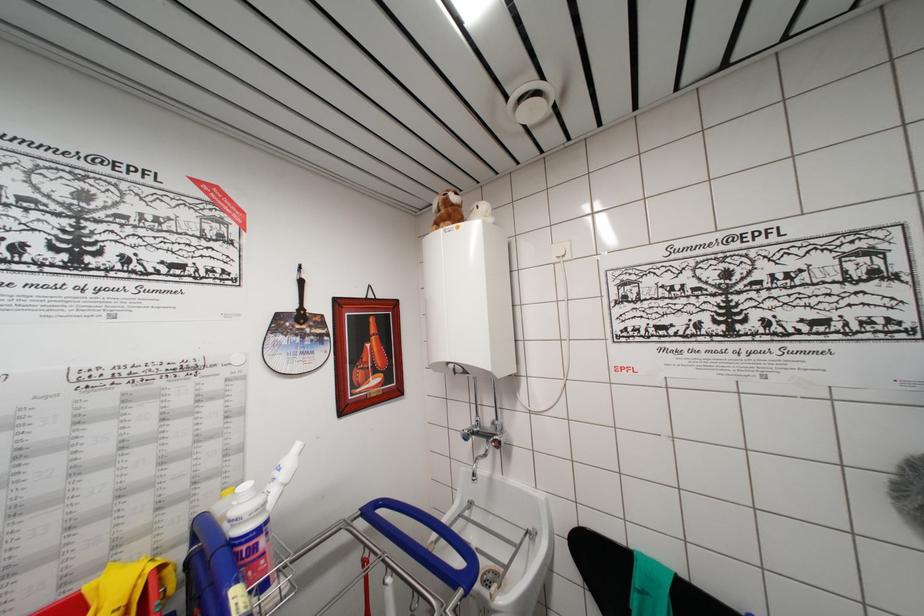
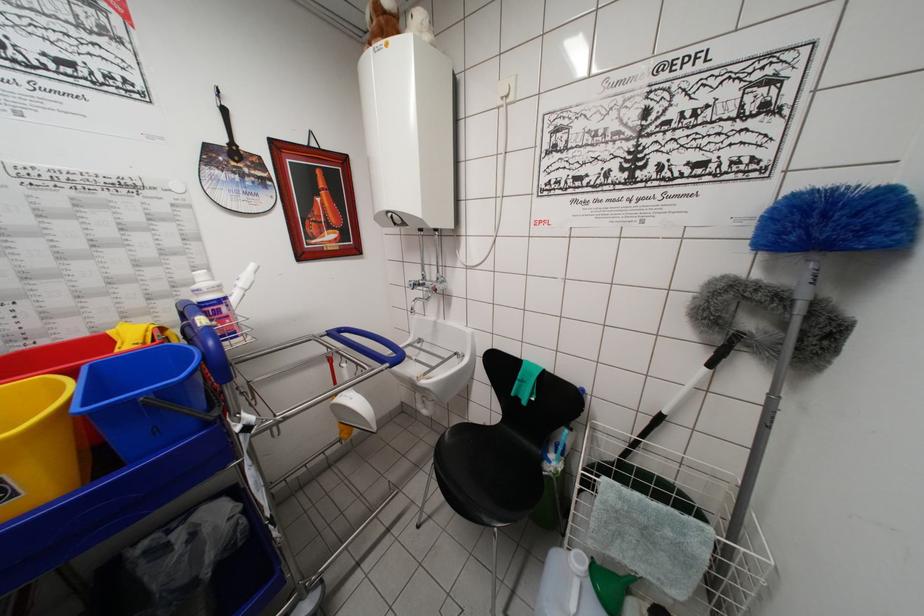
In the second image, find the point that corresponds to point (251, 553) in the first image.

(215, 315)